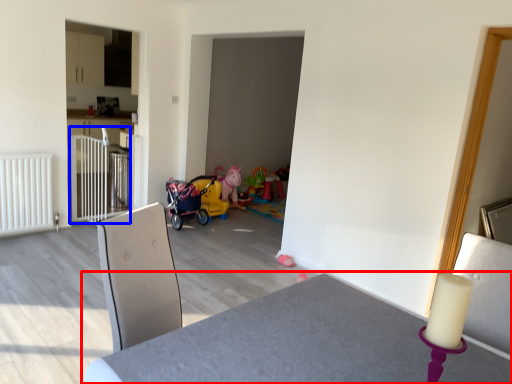
Question: Which object is further to the camera taking this photo, table (highlighted by a red box) or rail (highlighted by a blue box)?

Choices:
 (A) table
 (B) rail

Answer: (B)